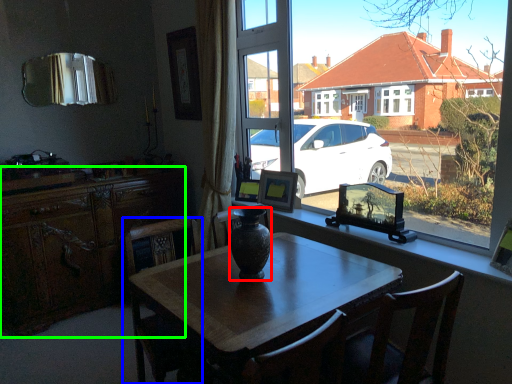
Question: Which is nearer to the vase (highlighted by a red box)? chair (highlighted by a blue box) or cabinetry (highlighted by a green box).

Choices:
 (A) chair
 (B) cabinetry

Answer: (A)